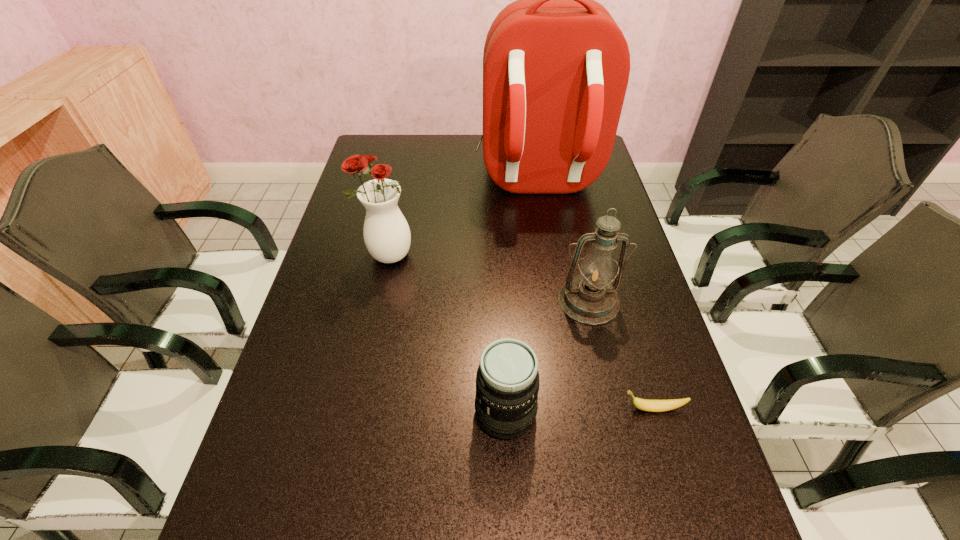
At what (x,y) coordinates should I click in order to perform the action: click on vacant space at the far edge. Please return your answer as a coordinate pair (x, y). Looking at the image, I should click on (408, 147).

Identify the location of vacant space at the right edge of the desktop. This screenshot has width=960, height=540. (592, 221).

The width and height of the screenshot is (960, 540). In the image, there is a desktop. What are the coordinates of `vacant region at the far left corner` in the screenshot? It's located at (394, 134).

Find the location of a particular element. vacant point located between the farthest object and the second shortest object is located at coordinates (521, 298).

I want to click on blank region between the vase and the telephoto lens, so click(446, 334).

Find the location of a particular element. This screenshot has width=960, height=540. vacant area that lies between the oil lamp and the tallest object is located at coordinates (563, 242).

I want to click on vacant area between the second shortest object and the tallest object, so click(x=521, y=298).

Where is `blank region between the fourth nearest object and the oil lamp`? blank region between the fourth nearest object and the oil lamp is located at coordinates (489, 279).

Locate an element on the screen. This screenshot has width=960, height=540. unoccupied area between the leftmost object and the banana is located at coordinates (520, 332).

Locate an element on the screen. The width and height of the screenshot is (960, 540). free spot between the telephoto lens and the tallest object is located at coordinates (521, 298).